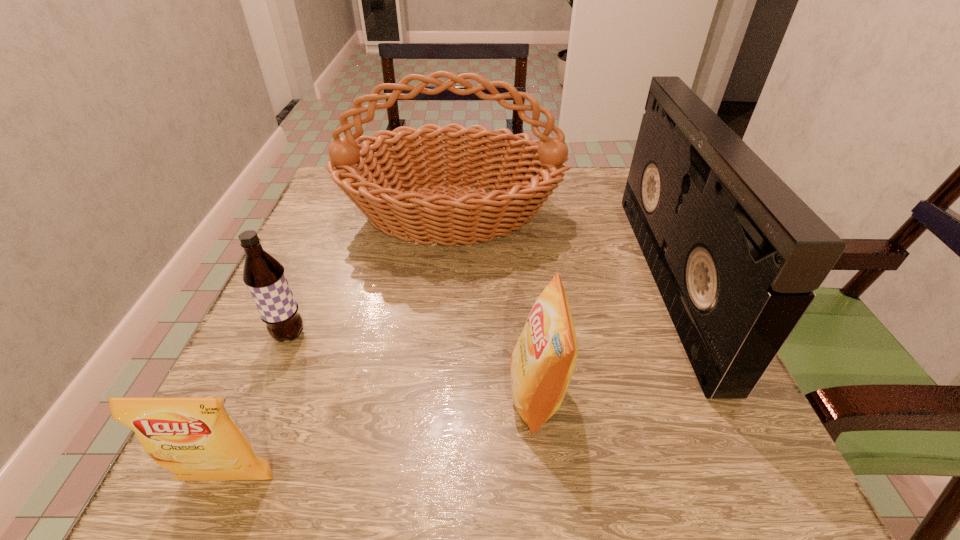
Locate which object is the closest to the root beer. Please provide its 2D coordinates. Your answer should be formatted as a tuple, i.e. [(x, y)], where the tuple contains the x and y coordinates of a point satisfying the conditions above.

[(395, 197)]

At what (x,y) coordinates should I click in order to perform the action: click on vacant region that satisfies the following two spatial constraints: 1. on the front side of the rightmost object; 2. on the front of the nearest object with the logo. Please return your answer as a coordinate pair (x, y). This screenshot has height=540, width=960. Looking at the image, I should click on tap(762, 479).